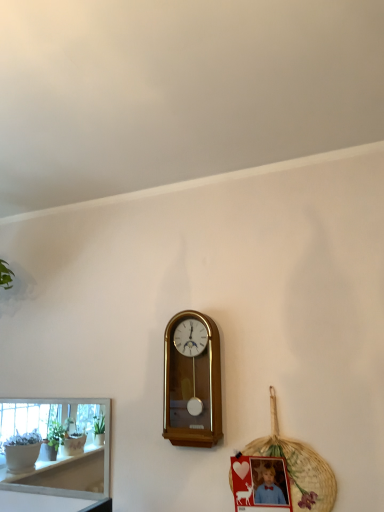
Question: From a real-world perspective, does wooden wall clock at center stand above matte plastic picture frame at lower right?

Choices:
 (A) yes
 (B) no

Answer: (A)

Question: From the image's perspective, would you say wooden wall clock at center is positioned over matte plastic picture frame at lower right?

Choices:
 (A) yes
 (B) no

Answer: (A)

Question: From a real-world perspective, is wooden wall clock at center under matte plastic picture frame at lower right?

Choices:
 (A) no
 (B) yes

Answer: (A)

Question: Considering the relative sizes of wooden wall clock at center and matte plastic picture frame at lower right in the image provided, is wooden wall clock at center shorter than matte plastic picture frame at lower right?

Choices:
 (A) no
 (B) yes

Answer: (A)

Question: Considering the relative positions of wooden wall clock at center and matte plastic picture frame at lower right in the image provided, is wooden wall clock at center to the right of matte plastic picture frame at lower right from the viewer's perspective?

Choices:
 (A) no
 (B) yes

Answer: (A)

Question: Looking at the image, does white glossy shelf at lower left seem bigger or smaller compared to wooden wall clock at center?

Choices:
 (A) small
 (B) big

Answer: (A)

Question: Considering the relative positions of white glossy shelf at lower left and wooden wall clock at center in the image provided, is white glossy shelf at lower left to the left or to the right of wooden wall clock at center?

Choices:
 (A) right
 (B) left

Answer: (B)

Question: Is white glossy shelf at lower left in front of or behind wooden wall clock at center in the image?

Choices:
 (A) behind
 (B) front

Answer: (A)

Question: Would you say white glossy shelf at lower left is inside or outside wooden wall clock at center?

Choices:
 (A) inside
 (B) outside

Answer: (B)

Question: Would you say woven straw basket at lower right is to the left or to the right of wooden wall clock at center in the picture?

Choices:
 (A) right
 (B) left

Answer: (A)

Question: Relative to wooden wall clock at center, is woven straw basket at lower right in front or behind?

Choices:
 (A) front
 (B) behind

Answer: (A)

Question: From a real-world perspective, is woven straw basket at lower right physically located above or below wooden wall clock at center?

Choices:
 (A) below
 (B) above

Answer: (A)

Question: Is point tap(316, 473) closer or farther from the camera than point tap(200, 355)?

Choices:
 (A) closer
 (B) farther

Answer: (A)

Question: In terms of size, does white glossy shelf at lower left appear bigger or smaller than matte plastic picture frame at lower right?

Choices:
 (A) small
 (B) big

Answer: (B)

Question: Is white glossy shelf at lower left taller or shorter than matte plastic picture frame at lower right?

Choices:
 (A) tall
 (B) short

Answer: (A)